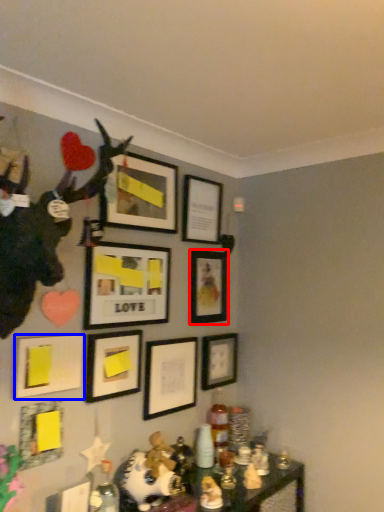
Question: Which point is further to the camera, picture frame (highlighted by a red box) or picture frame (highlighted by a blue box)?

Choices:
 (A) picture frame
 (B) picture frame

Answer: (A)